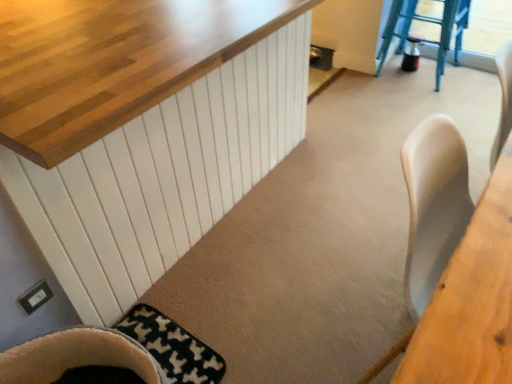
Question: Is wooden table at right positioned beyond the bounds of black and white textured mat at lower left?

Choices:
 (A) no
 (B) yes

Answer: (B)

Question: Is wooden table at right not near black and white textured mat at lower left?

Choices:
 (A) no
 (B) yes

Answer: (A)

Question: Does wooden table at right have a greater width compared to black and white textured mat at lower left?

Choices:
 (A) no
 (B) yes

Answer: (A)

Question: Can you confirm if wooden table at right is positioned to the right of black and white textured mat at lower left?

Choices:
 (A) no
 (B) yes

Answer: (B)

Question: Can black and white textured mat at lower left be found inside wooden table at right?

Choices:
 (A) no
 (B) yes

Answer: (A)

Question: From the image's perspective, is black and white textured mat at lower left located above or below blue plastic stool at upper right?

Choices:
 (A) below
 (B) above

Answer: (A)

Question: In terms of size, does black and white textured mat at lower left appear bigger or smaller than blue plastic stool at upper right?

Choices:
 (A) big
 (B) small

Answer: (B)

Question: Based on their positions, is black and white textured mat at lower left located to the left or right of blue plastic stool at upper right?

Choices:
 (A) left
 (B) right

Answer: (A)

Question: Considering the positions of black and white textured mat at lower left and blue plastic stool at upper right in the image, is black and white textured mat at lower left taller or shorter than blue plastic stool at upper right?

Choices:
 (A) short
 (B) tall

Answer: (A)

Question: Is wooden table at right wider or thinner than blue plastic stool at upper right?

Choices:
 (A) wide
 (B) thin

Answer: (B)

Question: From the image's perspective, relative to blue plastic stool at upper right, is wooden table at right above or below?

Choices:
 (A) above
 (B) below

Answer: (B)

Question: Is wooden table at right spatially inside blue plastic stool at upper right, or outside of it?

Choices:
 (A) inside
 (B) outside

Answer: (B)

Question: In the image, is wooden table at right positioned in front of or behind blue plastic stool at upper right?

Choices:
 (A) front
 (B) behind

Answer: (A)

Question: Considering the positions of black and white textured mat at lower left and wooden table at right in the image, is black and white textured mat at lower left bigger or smaller than wooden table at right?

Choices:
 (A) big
 (B) small

Answer: (B)

Question: Is point (198, 344) closer or farther from the camera than point (430, 382)?

Choices:
 (A) farther
 (B) closer

Answer: (A)